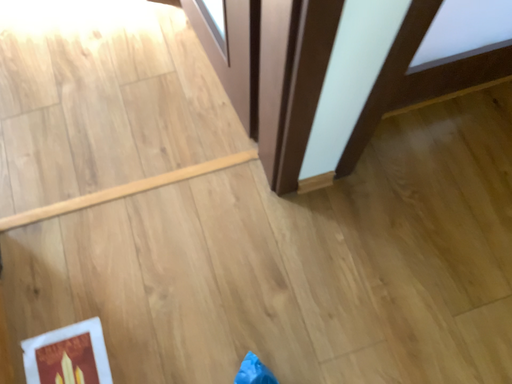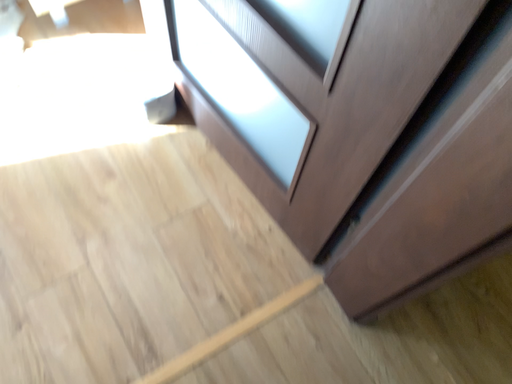
Question: How did the camera likely rotate when shooting the video?

Choices:
 (A) rotated left
 (B) rotated right

Answer: (B)